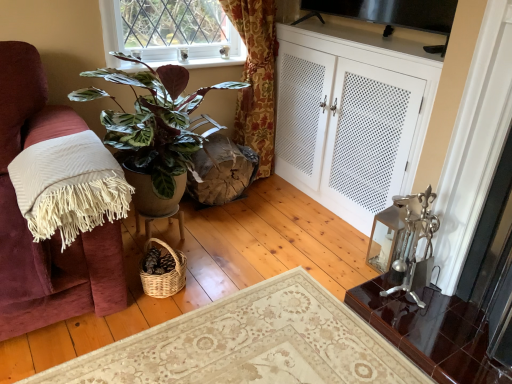
I want to click on free space above green leafy plant at upper center (from a real-world perspective), so click(200, 51).